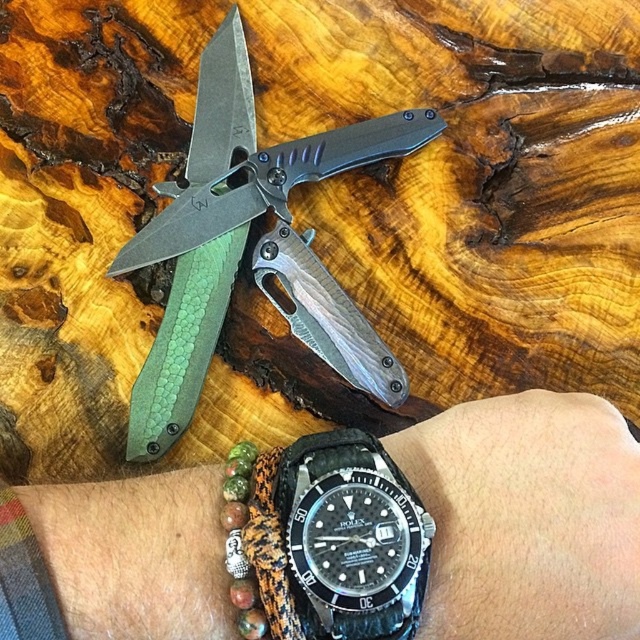
You are organizing items on a wooden surface and need to place the green textured knife at upper center and the black rubber watch at lower center. Based on their positions, which item is closer to the edge of the surface?

The black rubber watch at lower center is closer to the edge of the surface because it is positioned lower than the green textured knife at upper center, which is above it.

You are a watch collector examining two watches on a wooden surface. You notice the black leather watch at lower right and the black rubber watch at lower center. Which watch has a bigger size?

The black leather watch at lower right has a larger size compared to the black rubber watch at lower center.